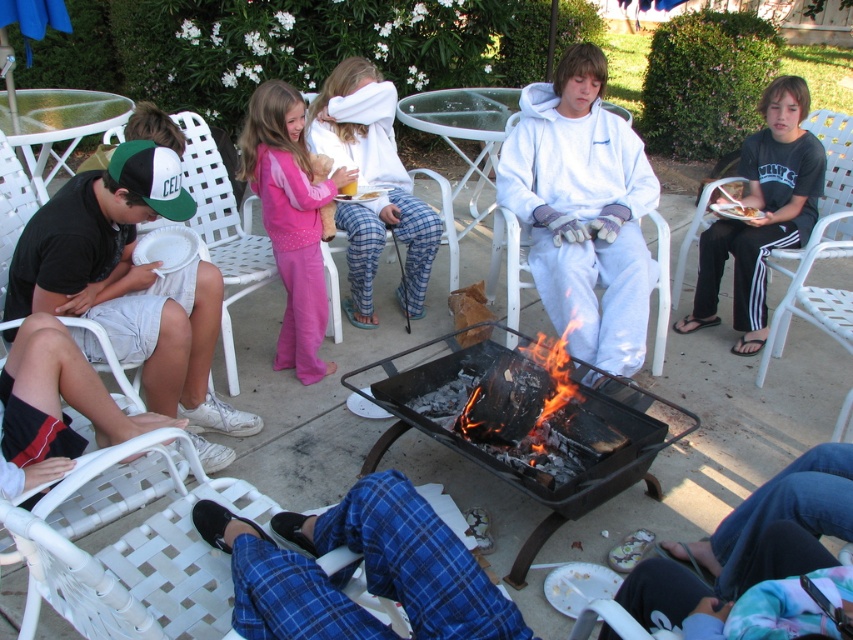
You are a photographer trying to capture a candid shot of the black cotton shorts at left and the charcoal fire at center. To ensure both are in focus, you need to know their relative heights. Which object is taller?

The black cotton shorts at left is much taller than the charcoal fire at center.

You are at a family gathering and want to sit down. You see a black cotton shirt at right and a white woven plastic chair at left. Which object is positioned to the right of the other?

The black cotton shirt at right is positioned to the right of the white woven plastic chair at left.

You are a guest at the gathering and want to move from your position near the black cotton shorts at left to the charcoal fire at center. Considering the distance between them, can you walk directly to the fire without needing to take more than two steps?

The black cotton shorts at left and charcoal fire at center are 1.12 meters apart. Assuming an average step length of about 0.75 meters, two steps would cover approximately 1.5 meters, which is more than enough to cover the 1.12 meters distance. Therefore, you can easily walk directly to the fire in two steps or fewer.